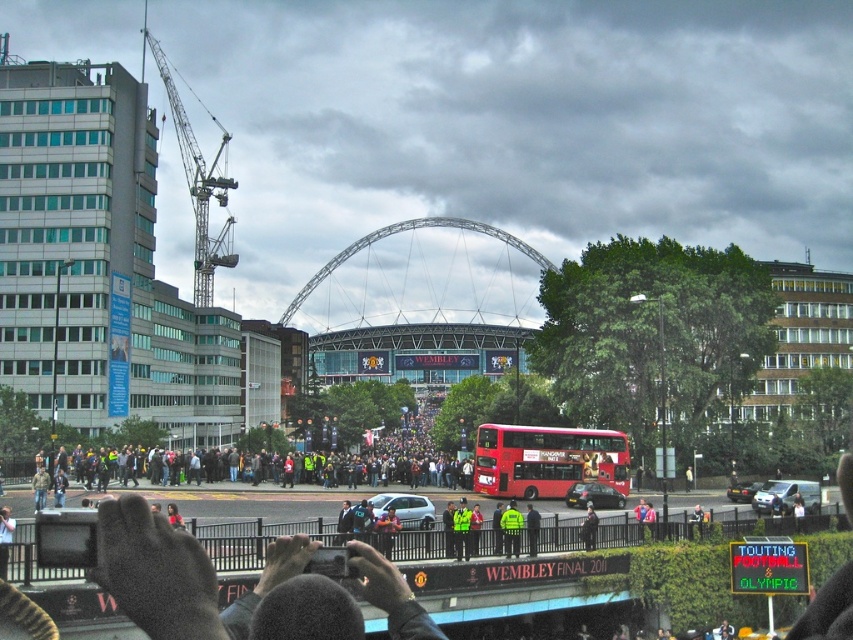
Who is positioned more to the right, neon green uniform at center or metallic silver car at center-right?

Positioned to the right is metallic silver car at center-right.

Who is more forward, (509, 532) or (747, 483)?

Point (509, 532) is in front.

Is point (515, 540) positioned before point (758, 486)?

That is True.

You are a GUI agent. You are given a task and a screenshot of the screen. Output one action in this format:
    pyautogui.click(x=<x>, y=<y>)
    Task: Click on the neon green uniform at center
    
    Given the screenshot: What is the action you would take?
    pyautogui.click(x=511, y=529)

Can you confirm if red matte double-decker bus at center is positioned to the right of green uniformed person at center?

Correct, you'll find red matte double-decker bus at center to the right of green uniformed person at center.

Between point (480, 440) and point (529, 554), which one is positioned in front?

Point (529, 554) is more forward.

Between point (523, 426) and point (535, 536), which one is positioned in front?

Point (535, 536) is in front.

Locate an element on the screen. The height and width of the screenshot is (640, 853). red matte double-decker bus at center is located at coordinates (547, 460).

Who is more distant from viewer, (579, 484) or (741, 500)?

Positioned behind is point (741, 500).

What do you see at coordinates (593, 496) in the screenshot? I see `metallic silver car at center` at bounding box center [593, 496].

The width and height of the screenshot is (853, 640). What are the coordinates of `metallic silver car at center` in the screenshot? It's located at (593, 496).